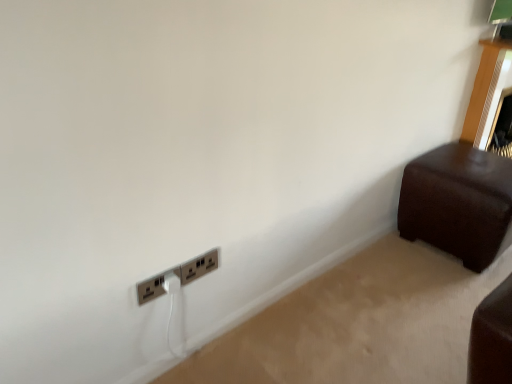
Question: Considering the relative positions of satin silver power plugs and sockets at lower left, placed as the 2th power plugs and sockets when sorted from left to right, and metallic silver power plugs and sockets at lower left, the 1th power plugs and sockets in the left-to-right sequence, in the image provided, is satin silver power plugs and sockets at lower left, placed as the 2th power plugs and sockets when sorted from left to right, to the right of metallic silver power plugs and sockets at lower left, the 1th power plugs and sockets in the left-to-right sequence, from the viewer's perspective?

Choices:
 (A) no
 (B) yes

Answer: (B)

Question: From the image's perspective, does satin silver power plugs and sockets at lower left, which is the 1th power plugs and sockets from right to left, appear lower than metallic silver power plugs and sockets at lower left, which ranks as the 2th power plugs and sockets in right-to-left order?

Choices:
 (A) no
 (B) yes

Answer: (A)

Question: Is satin silver power plugs and sockets at lower left, placed as the 2th power plugs and sockets when sorted from left to right, completely or partially outside of metallic silver power plugs and sockets at lower left, the 1th power plugs and sockets in the left-to-right sequence?

Choices:
 (A) no
 (B) yes

Answer: (B)

Question: Is satin silver power plugs and sockets at lower left, placed as the 2th power plugs and sockets when sorted from left to right, surrounding metallic silver power plugs and sockets at lower left, which ranks as the 2th power plugs and sockets in right-to-left order?

Choices:
 (A) yes
 (B) no

Answer: (B)

Question: Does satin silver power plugs and sockets at lower left, which is the 1th power plugs and sockets from right to left, come behind metallic silver power plugs and sockets at lower left, which ranks as the 2th power plugs and sockets in right-to-left order?

Choices:
 (A) no
 (B) yes

Answer: (B)

Question: Considering the relative sizes of satin silver power plugs and sockets at lower left, which is the 1th power plugs and sockets from right to left, and metallic silver power plugs and sockets at lower left, which ranks as the 2th power plugs and sockets in right-to-left order, in the image provided, is satin silver power plugs and sockets at lower left, which is the 1th power plugs and sockets from right to left, smaller than metallic silver power plugs and sockets at lower left, which ranks as the 2th power plugs and sockets in right-to-left order,?

Choices:
 (A) no
 (B) yes

Answer: (B)

Question: Is satin silver power plugs and sockets at lower left, which is the 1th power plugs and sockets from right to left, outside of brown leather ottoman at right?

Choices:
 (A) yes
 (B) no

Answer: (A)

Question: Does satin silver power plugs and sockets at lower left, placed as the 2th power plugs and sockets when sorted from left to right, turn towards brown leather ottoman at right?

Choices:
 (A) yes
 (B) no

Answer: (B)

Question: Does satin silver power plugs and sockets at lower left, placed as the 2th power plugs and sockets when sorted from left to right, lie behind brown leather ottoman at right?

Choices:
 (A) no
 (B) yes

Answer: (A)

Question: Is the position of satin silver power plugs and sockets at lower left, placed as the 2th power plugs and sockets when sorted from left to right, less distant than that of brown leather ottoman at right?

Choices:
 (A) yes
 (B) no

Answer: (A)

Question: Does satin silver power plugs and sockets at lower left, placed as the 2th power plugs and sockets when sorted from left to right, have a lesser width compared to brown leather ottoman at right?

Choices:
 (A) yes
 (B) no

Answer: (A)

Question: From the image's perspective, would you say satin silver power plugs and sockets at lower left, which is the 1th power plugs and sockets from right to left, is positioned over brown leather ottoman at right?

Choices:
 (A) no
 (B) yes

Answer: (A)

Question: Would you say brown leather ottoman at right is outside satin silver power plugs and sockets at lower left, which is the 1th power plugs and sockets from right to left?

Choices:
 (A) yes
 (B) no

Answer: (A)